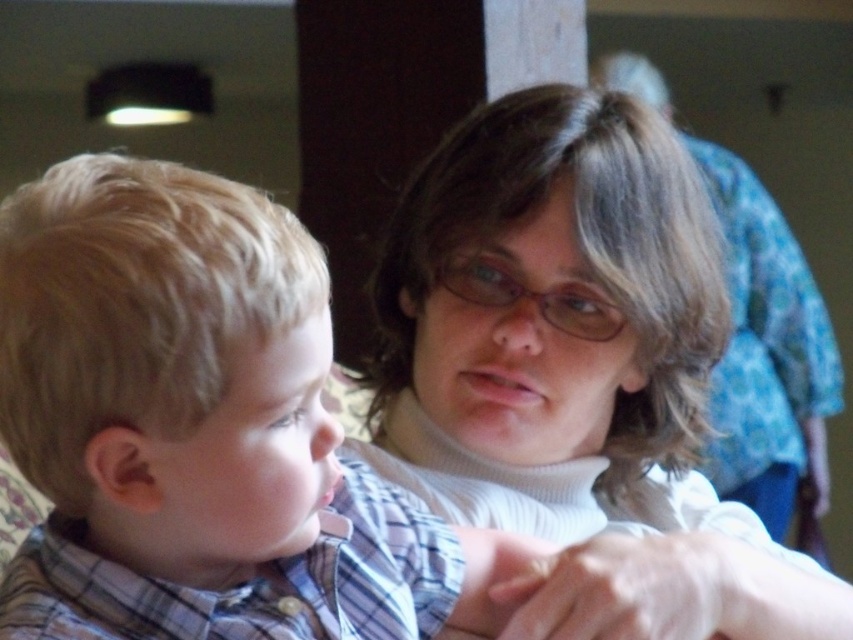
Does plaid shirt at left appear over white turtleneck sweater at center?

Actually, plaid shirt at left is below white turtleneck sweater at center.

What do you see at coordinates (198, 426) in the screenshot? Image resolution: width=853 pixels, height=640 pixels. I see `plaid shirt at left` at bounding box center [198, 426].

Describe the element at coordinates (198, 426) in the screenshot. I see `plaid shirt at left` at that location.

Find the location of a particular element. This screenshot has height=640, width=853. plaid shirt at left is located at coordinates (198, 426).